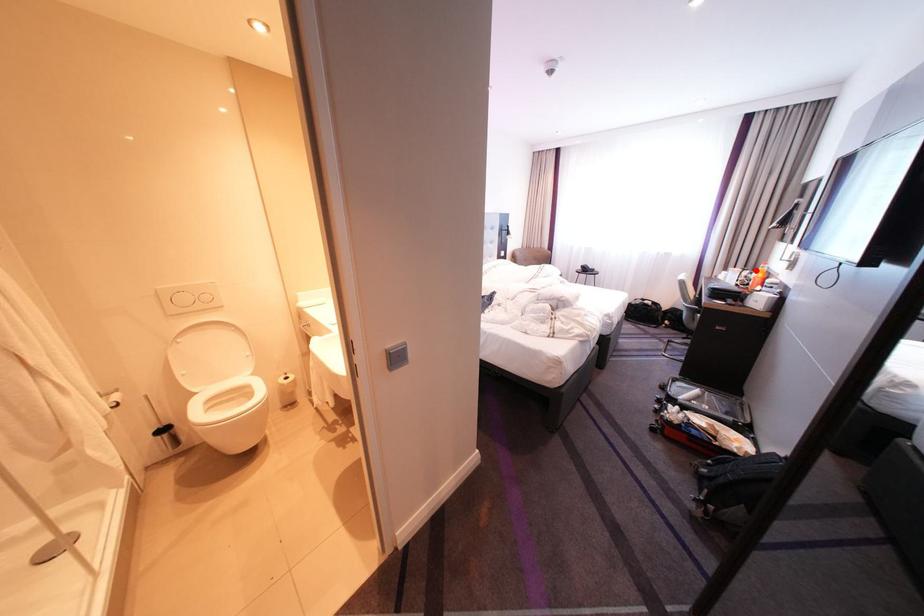
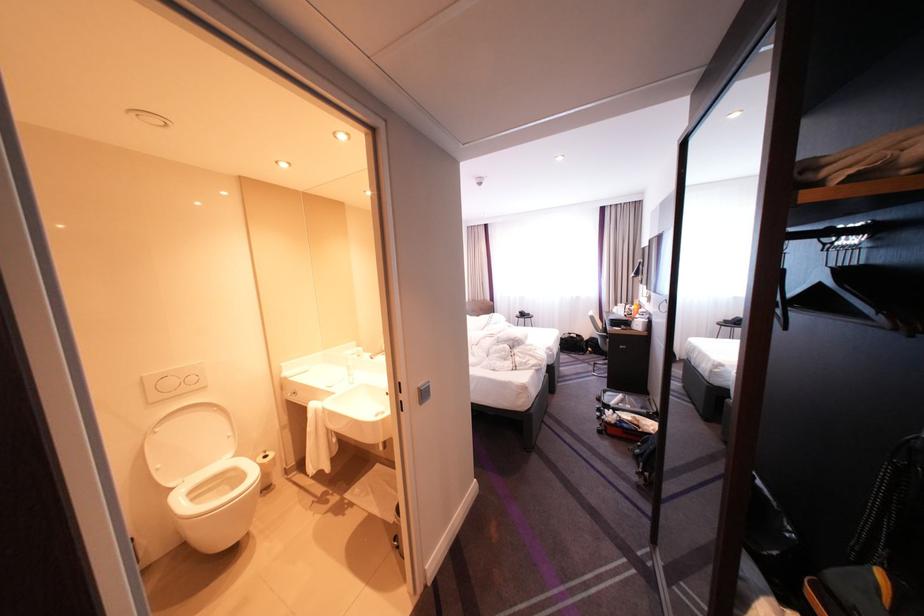
The point at the highlighted location is marked in the first image. Where is the corresponding point in the second image?

(638, 305)